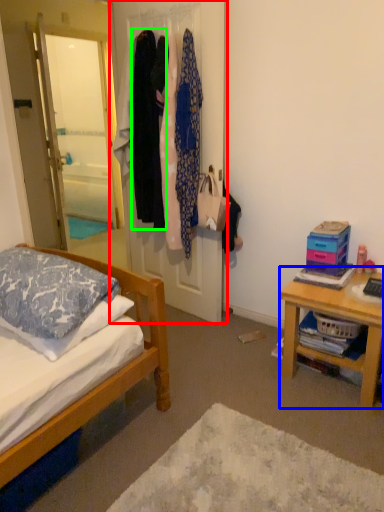
Question: Which is nearer to the closet (highlighted by a red box)? desk (highlighted by a blue box) or clothing (highlighted by a green box).

Choices:
 (A) desk
 (B) clothing

Answer: (B)